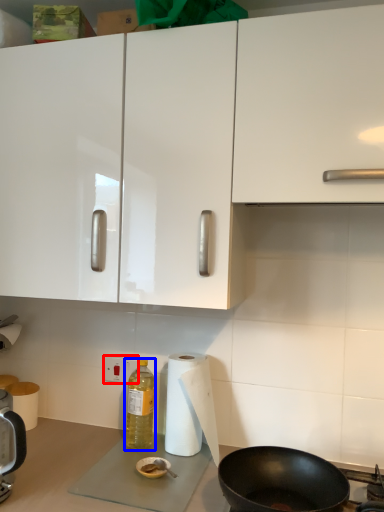
Question: Which of the following is the closest to the observer, electric outlet (highlighted by a red box) or bottle (highlighted by a blue box)?

Choices:
 (A) electric outlet
 (B) bottle

Answer: (B)